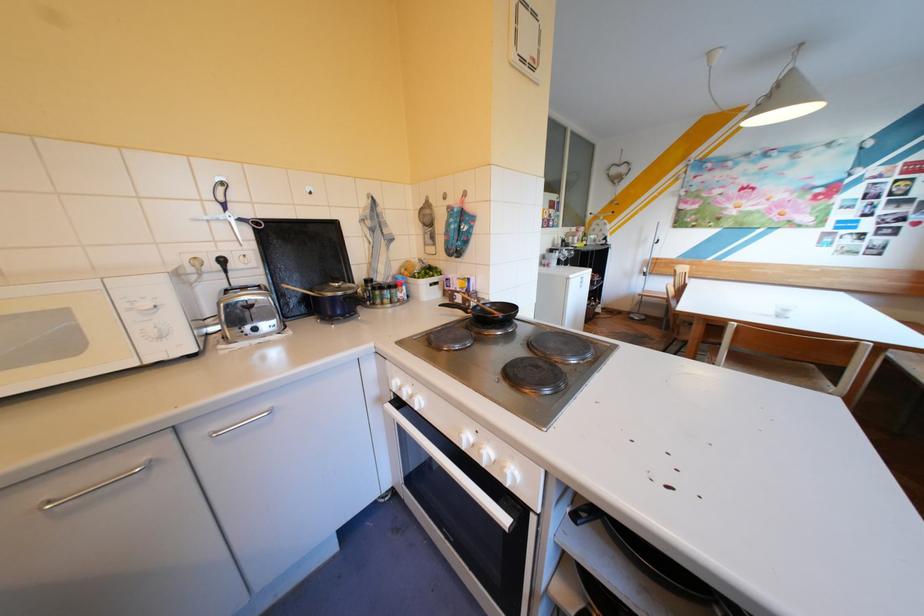
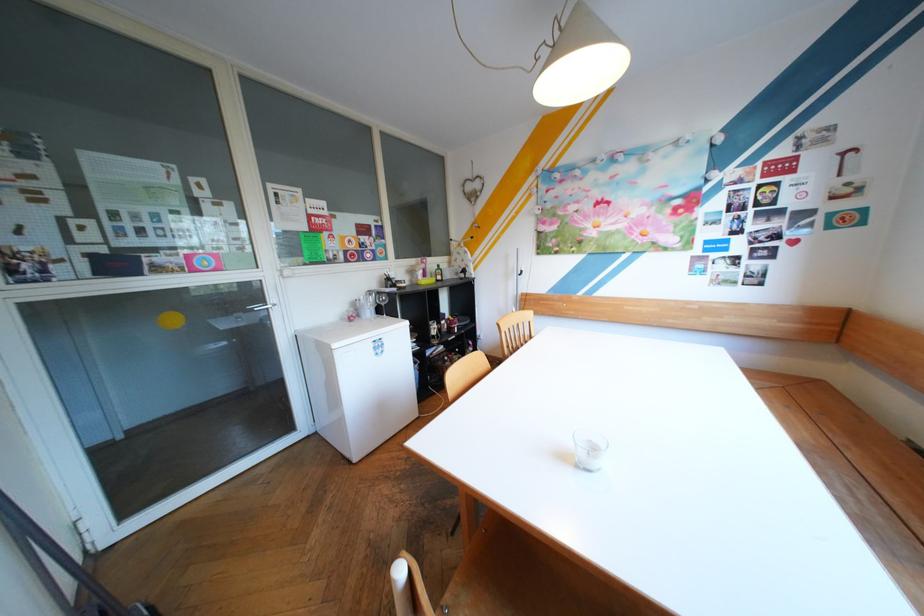
In a continuous first-person perspective shot, in which direction is the camera moving?

The cameraman walked toward right, forward.